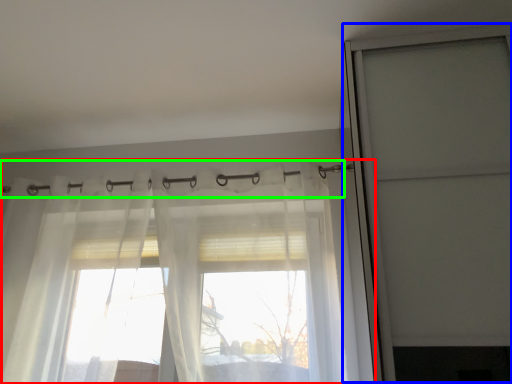
Question: Which object is positioned farthest from curtain (highlighted by a red box)? Select from screen door (highlighted by a blue box) and clothesline (highlighted by a green box).

Choices:
 (A) screen door
 (B) clothesline

Answer: (A)